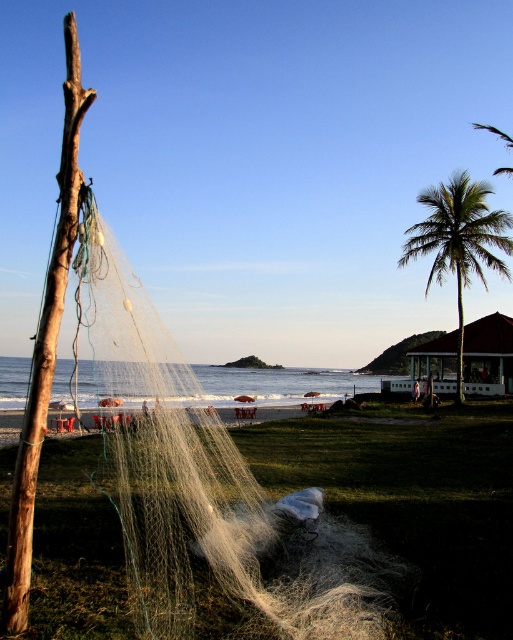
Describe the element at coordinates (460, 241) in the screenshot. This screenshot has height=640, width=513. I see `green leafy palm tree at right` at that location.

Locate an element on the screen. This screenshot has width=513, height=640. green leafy palm tree at right is located at coordinates (460, 241).

Locate an element on the screen. green leafy palm tree at right is located at coordinates (460, 241).

Can you confirm if white mesh fishing net at center is positioned to the right of brown wooden hut at center-right?

Incorrect, white mesh fishing net at center is not on the right side of brown wooden hut at center-right.

At what (x,y) coordinates should I click in order to perform the action: click on white mesh fishing net at center. Please return your answer as a coordinate pair (x, y). Looking at the image, I should click on (208, 484).

Does brown wooden hut at center-right come behind white sand beach at center?

Yes, brown wooden hut at center-right is further from the viewer.

Can you confirm if brown wooden hut at center-right is thinner than white sand beach at center?

Correct, brown wooden hut at center-right's width is less than white sand beach at center's.

Measure the distance between point [487,326] and camera.

Point [487,326] is 42.73 meters away from camera.

Find the location of a particular element. The height and width of the screenshot is (640, 513). brown wooden hut at center-right is located at coordinates tap(489, 346).